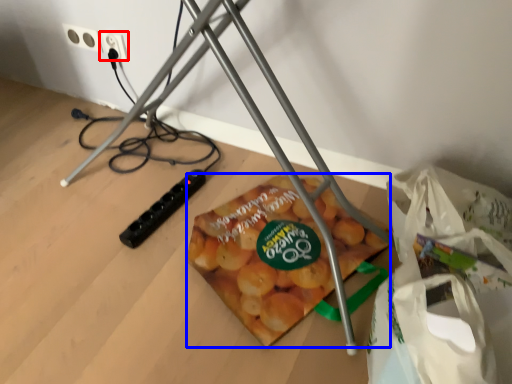
Question: Which point is further to the camera, power plugs and sockets (highlighted by a red box) or snack (highlighted by a blue box)?

Choices:
 (A) power plugs and sockets
 (B) snack

Answer: (A)